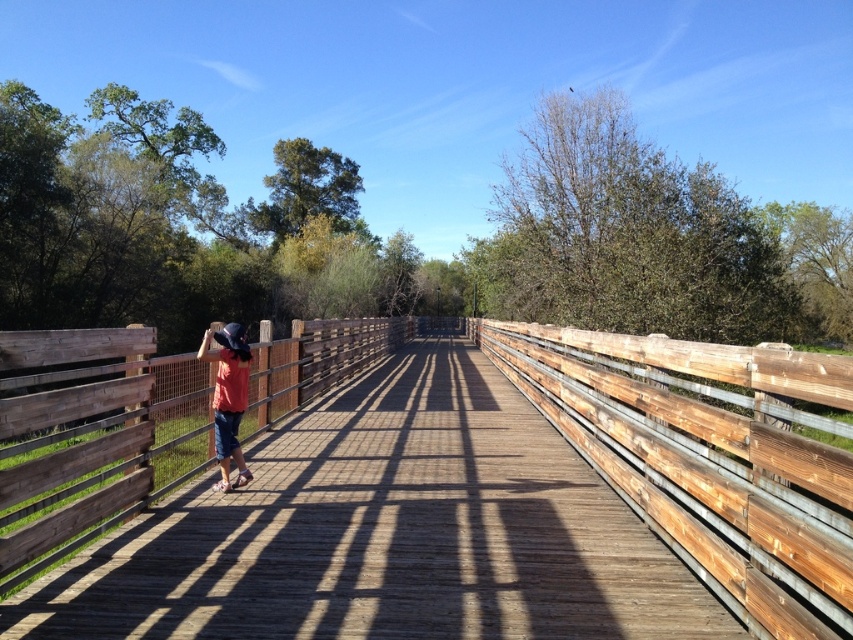
Is wooden bridge at center thinner than denim shorts at left?

Incorrect, wooden bridge at center's width is not less than denim shorts at left's.

Which is behind, point (585, 493) or point (219, 445)?

The point (585, 493) is behind.

Locate an element on the screen. This screenshot has height=640, width=853. wooden bridge at center is located at coordinates (387, 532).